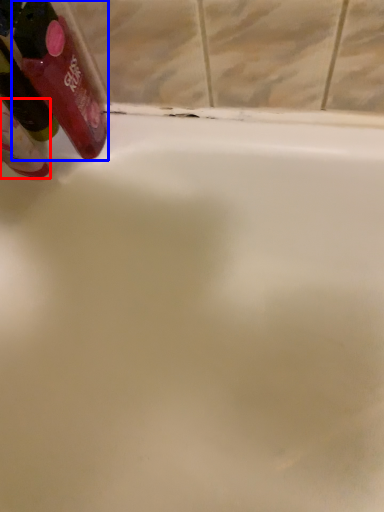
Question: Among these objects, which one is nearest to the camera, mouthwash (highlighted by a red box) or mouthwash (highlighted by a blue box)?

Choices:
 (A) mouthwash
 (B) mouthwash

Answer: (B)